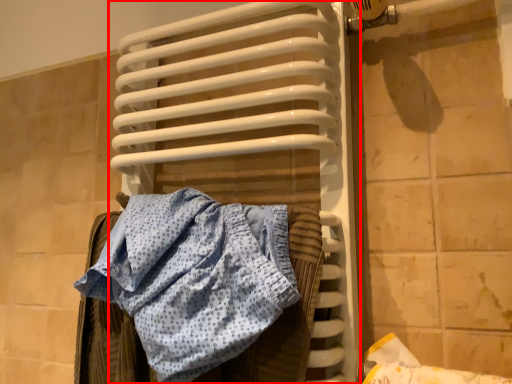
Question: From the image's perspective, where is radiator (annotated by the red box) located in relation to towel in the image?

Choices:
 (A) below
 (B) above

Answer: (B)